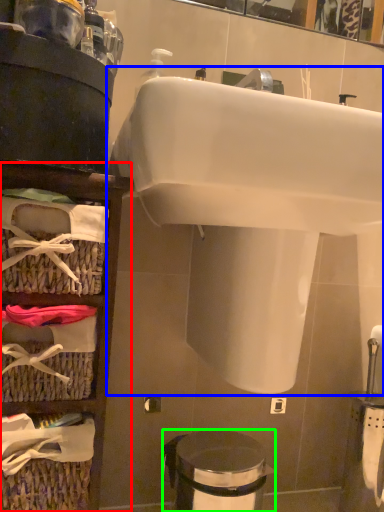
Question: Which is farther away from shelf (highlighted by a red box)? sink (highlighted by a blue box) or trash bin/can (highlighted by a green box)?

Choices:
 (A) sink
 (B) trash bin/can

Answer: (B)